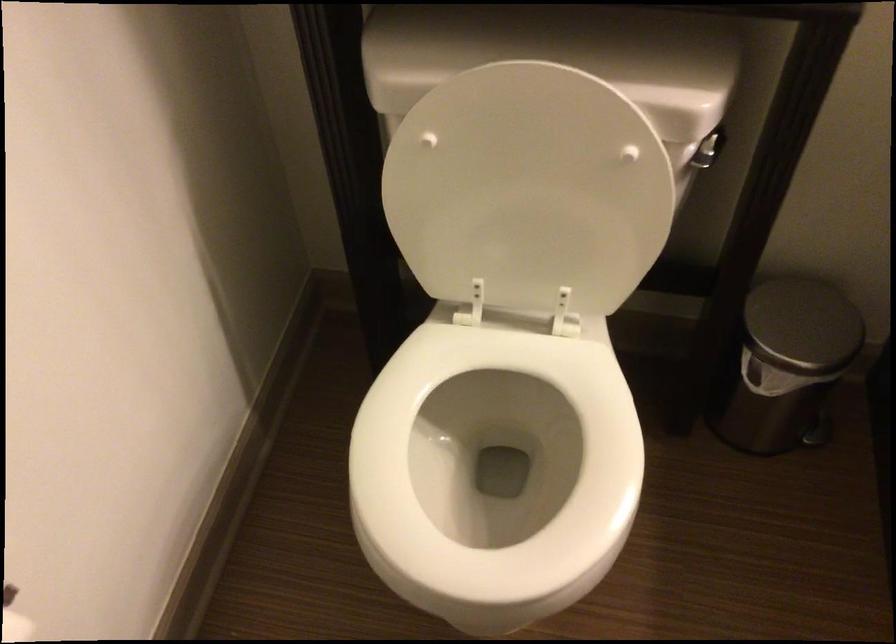
Describe the element at coordinates (494, 468) in the screenshot. I see `a white toilet seat` at that location.